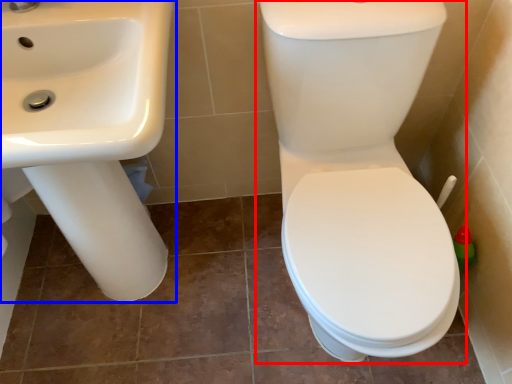
Question: Which object is further to the camera taking this photo, toilet (highlighted by a red box) or sink (highlighted by a blue box)?

Choices:
 (A) toilet
 (B) sink

Answer: (B)